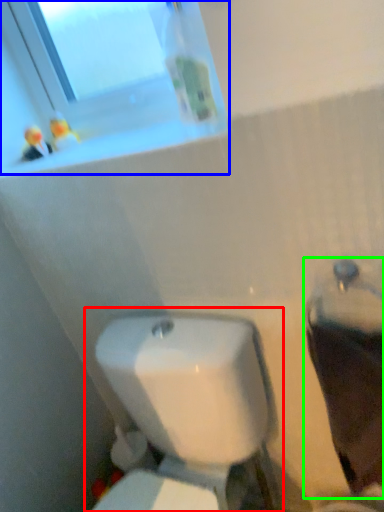
Question: Based on their relative distances, which object is nearer to toilet (highlighted by a red box)? Choose from window (highlighted by a blue box) and porcelain (highlighted by a green box).

Choices:
 (A) window
 (B) porcelain

Answer: (B)